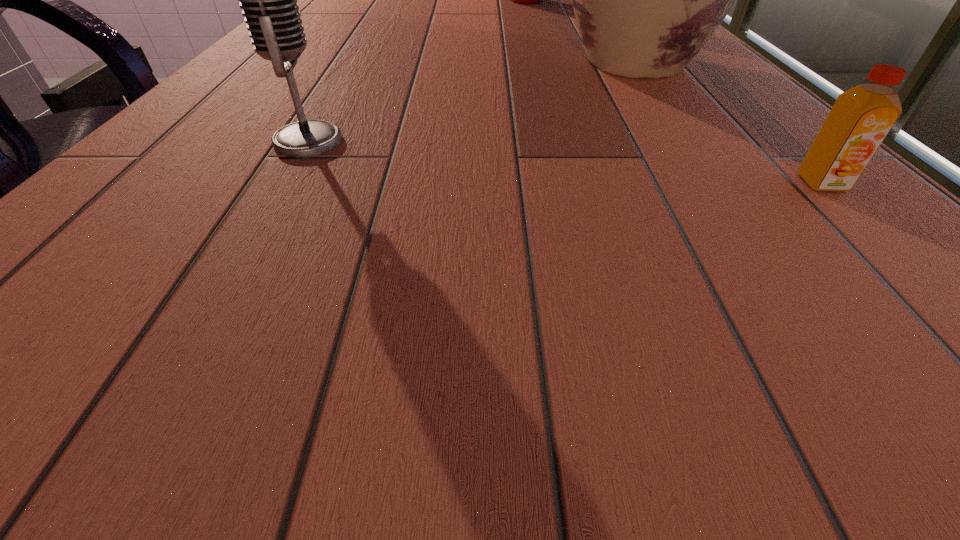
Locate an element on the screen. The height and width of the screenshot is (540, 960). vacant space on the desktop that is between the second shortest object and the orange juice and is positioned on the front label of the farthest object is located at coordinates (626, 167).

In order to click on vacant space on the desktop that is between the second nearest object and the orange juice and is positioned on the spout of the pitcher in this screenshot , I will do `click(507, 158)`.